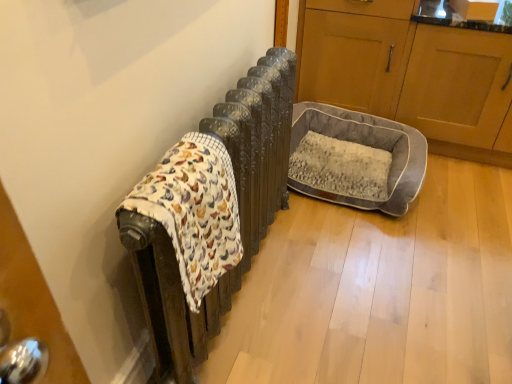
Question: Is fluffy cotton blanket at left not close to wooden cabinet at right, which appears as the 1th screen door when viewed from the front?

Choices:
 (A) no
 (B) yes

Answer: (B)

Question: Is fluffy cotton blanket at left next to wooden cabinet at right, which appears as the 1th screen door when viewed from the front, and touching it?

Choices:
 (A) yes
 (B) no

Answer: (B)

Question: From a real-world perspective, is fluffy cotton blanket at left on wooden cabinet at right, acting as the second screen door starting from the back?

Choices:
 (A) no
 (B) yes

Answer: (B)

Question: Is fluffy cotton blanket at left to the right of wooden cabinet at right, acting as the second screen door starting from the back, from the viewer's perspective?

Choices:
 (A) yes
 (B) no

Answer: (B)

Question: From the image's perspective, is fluffy cotton blanket at left over wooden cabinet at right, acting as the second screen door starting from the back?

Choices:
 (A) no
 (B) yes

Answer: (A)

Question: Considering the positions of fluffy cotton blanket at left and wooden cabinet at right, which appears as the 1th screen door when viewed from the front, in the image, is fluffy cotton blanket at left bigger or smaller than wooden cabinet at right, which appears as the 1th screen door when viewed from the front,?

Choices:
 (A) big
 (B) small

Answer: (B)

Question: Relative to wooden cabinet at right, acting as the second screen door starting from the back, is fluffy cotton blanket at left in front or behind?

Choices:
 (A) front
 (B) behind

Answer: (A)

Question: Visually, is fluffy cotton blanket at left positioned to the left or to the right of wooden cabinet at right, acting as the second screen door starting from the back?

Choices:
 (A) left
 (B) right

Answer: (A)

Question: Considering the positions of fluffy cotton blanket at left and wooden cabinet at right, which appears as the 1th screen door when viewed from the front, in the image, is fluffy cotton blanket at left wider or thinner than wooden cabinet at right, which appears as the 1th screen door when viewed from the front,?

Choices:
 (A) thin
 (B) wide

Answer: (A)

Question: From the image's perspective, is fluffy cotton blanket at left located above or below gray plush dog bed at center?

Choices:
 (A) above
 (B) below

Answer: (B)

Question: In the image, is fluffy cotton blanket at left positioned in front of or behind gray plush dog bed at center?

Choices:
 (A) front
 (B) behind

Answer: (A)

Question: Looking at their shapes, would you say fluffy cotton blanket at left is wider or thinner than gray plush dog bed at center?

Choices:
 (A) thin
 (B) wide

Answer: (A)

Question: In the image, is fluffy cotton blanket at left on the left side or the right side of gray plush dog bed at center?

Choices:
 (A) right
 (B) left

Answer: (B)

Question: Is gray fabric pet bed at right, which is the 1th screen door in back-to-front order, spatially inside wooden cabinet at right, acting as the second screen door starting from the back, or outside of it?

Choices:
 (A) inside
 (B) outside

Answer: (B)

Question: In the image, is gray fabric pet bed at right, acting as the second screen door starting from the front, positioned in front of or behind wooden cabinet at right, acting as the second screen door starting from the back?

Choices:
 (A) front
 (B) behind

Answer: (B)